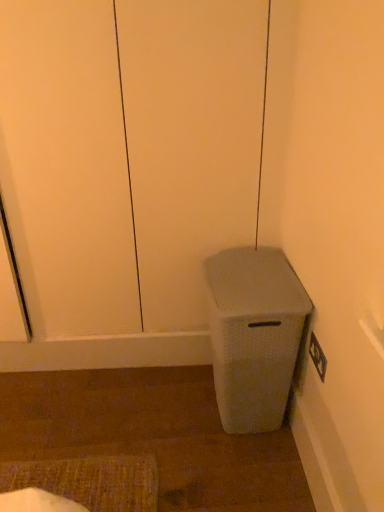
Question: Does point coord(221,216) appear closer or farther from the camera than point coord(213,270)?

Choices:
 (A) closer
 (B) farther

Answer: (B)

Question: Based on their sizes in the image, would you say white textured screen door at lower right is bigger or smaller than white textured waste bin at lower right?

Choices:
 (A) big
 (B) small

Answer: (A)

Question: From a real-world perspective, is white textured screen door at lower right above or below white textured waste bin at lower right?

Choices:
 (A) below
 (B) above

Answer: (B)

Question: Considering their positions, is white textured waste bin at lower right located in front of or behind white textured screen door at lower right?

Choices:
 (A) front
 (B) behind

Answer: (B)

Question: From the image's perspective, relative to white textured screen door at lower right, is white textured waste bin at lower right above or below?

Choices:
 (A) below
 (B) above

Answer: (A)

Question: Is point (279, 300) positioned closer to the camera than point (246, 8)?

Choices:
 (A) closer
 (B) farther

Answer: (A)

Question: In terms of size, does white textured waste bin at lower right appear bigger or smaller than white textured screen door at lower right?

Choices:
 (A) big
 (B) small

Answer: (B)